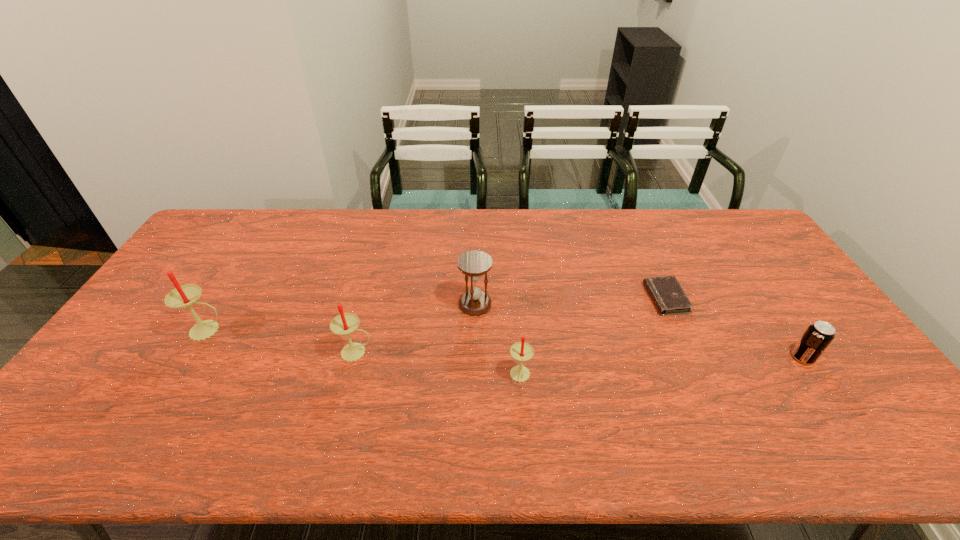
Given the evenly spaced candles in the image, where should an extra candle be added on the right to preserve the spacing? Please point to a vacant space. Please provide its 2D coordinates. Your answer should be formatted as a tuple, i.e. [(x, y)], where the tuple contains the x and y coordinates of a point satisfying the conditions above.

[(701, 403)]